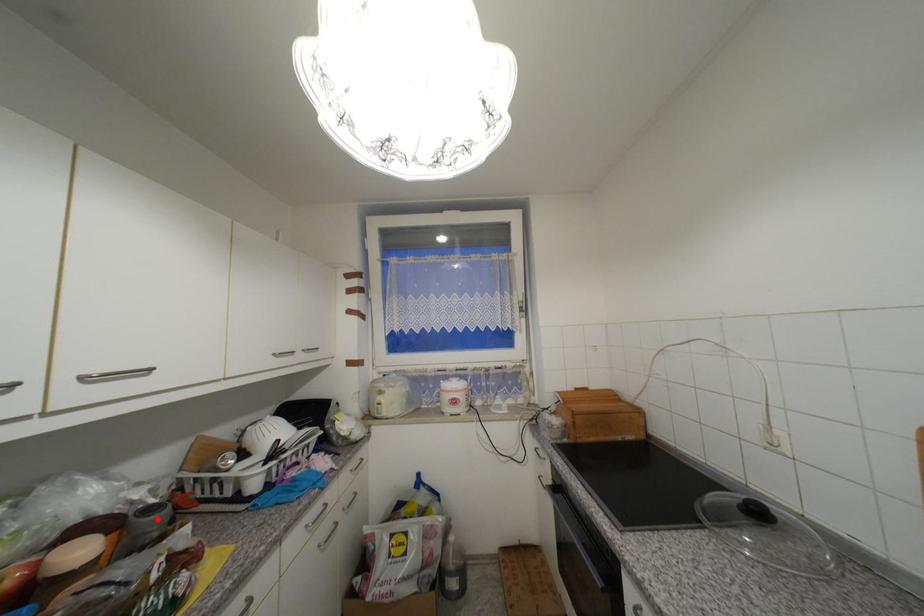
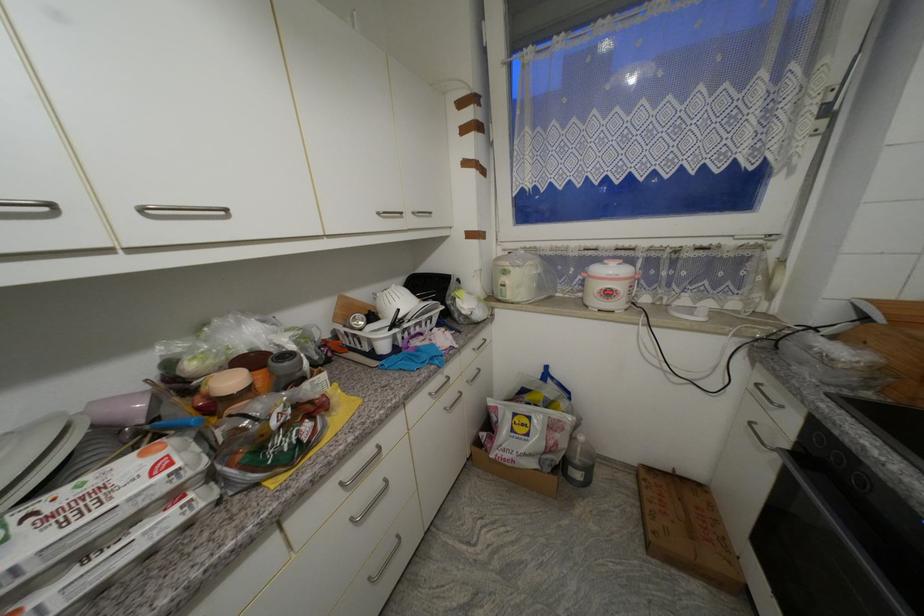
Where in the second image is the point corresponding to the highlighted location from the first image?

(292, 365)